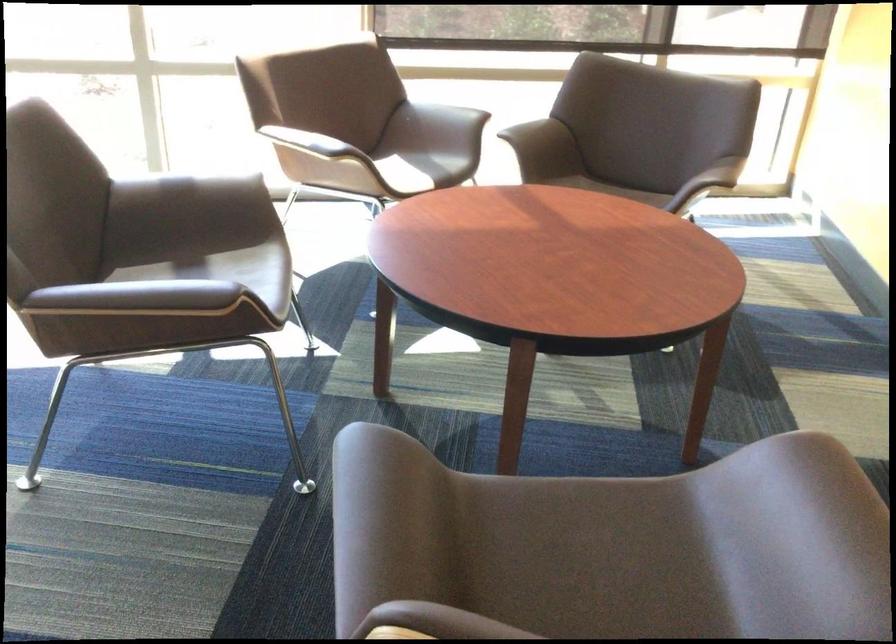
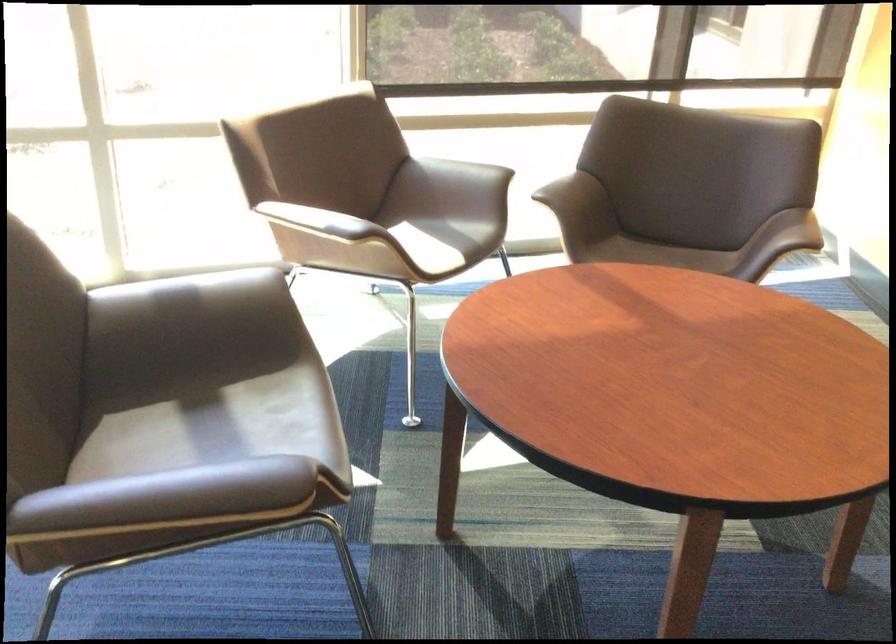
The point at (x=185, y=279) is marked in the first image. Where is the corresponding point in the second image?

(197, 417)